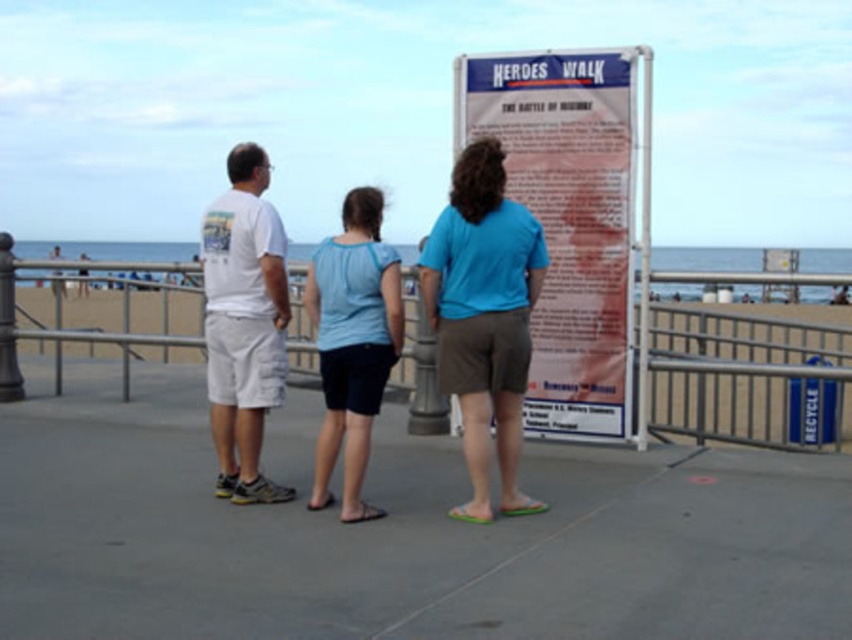
You are a photographer trying to capture a group photo of the two people in the center wearing blue shirts. The camera you are using has a lens that can only focus on objects within a 1.2 meter width. Given that the blue cotton shirt at center is wider than the light blue fabric shirt at center, will the camera be able to capture both shirts within the frame?

The blue cotton shirt at center is wider than the light blue fabric shirt at center. Since the camera lens can focus on objects within a 1.2 meter width, but the exact width of the shirts isn not provided, it is uncertain if both will fit. However, if the combined width of both shirts is less than or equal to 1.2 meters, they can be captured. Without specific measurements, we cannot confirm.